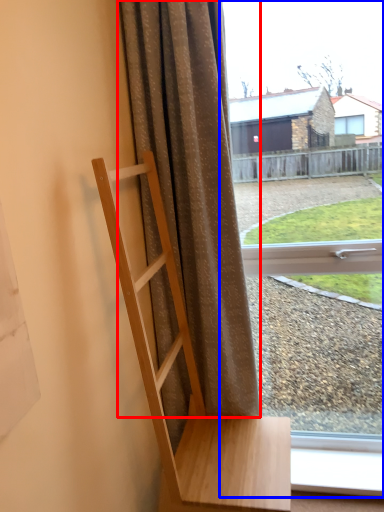
Question: Which point is closer to the camera, curtain (highlighted by a red box) or window (highlighted by a blue box)?

Choices:
 (A) curtain
 (B) window

Answer: (A)